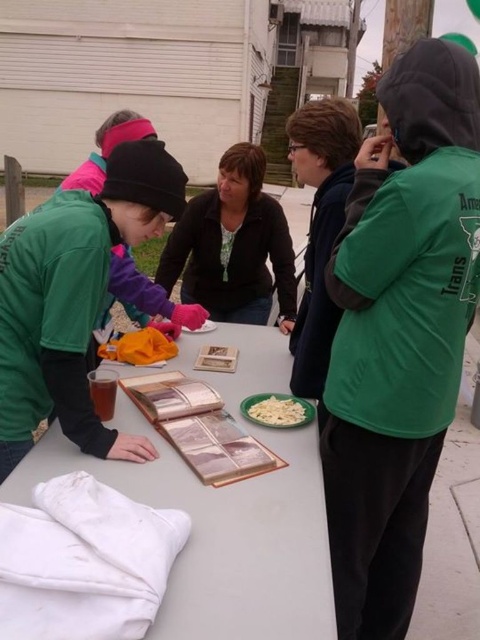
Is point (183, 480) farther from camera compared to point (250, 417)?

No, (183, 480) is in front of (250, 417).

Measure the distance between point (152, 474) and camera.

Point (152, 474) is 4.46 feet from camera.

Identify the location of white fabric at lower left. (224, 509).

Find the location of a particular element. Image resolution: width=480 pixels, height=640 pixels. white fabric at lower left is located at coordinates pos(224,509).

Is green matte hoodie at upper right positioned at the back of white creamy pasta at center?

No, green matte hoodie at upper right is in front of white creamy pasta at center.

Does point (338, 480) come behind point (292, 406)?

No, it is not.

This screenshot has height=640, width=480. What are the coordinates of `green matte hoodie at upper right` in the screenshot? It's located at (399, 332).

Can you confirm if green matte jacket at center is smaller than white creamy pasta at center?

No.

Which is behind, point (149, 189) or point (286, 413)?

The point (286, 413) is behind.

The width and height of the screenshot is (480, 640). Find the location of `green matte jacket at center`. green matte jacket at center is located at coordinates click(73, 298).